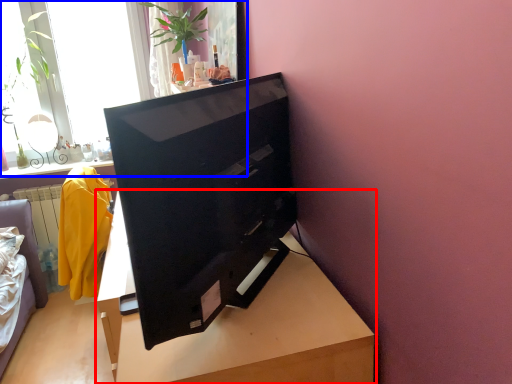
Question: Which of the following is the closest to the observer, table (highlighted by a red box) or window (highlighted by a blue box)?

Choices:
 (A) table
 (B) window

Answer: (A)